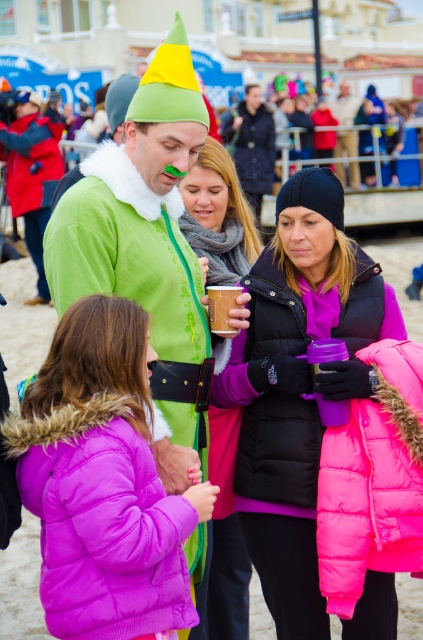
Does green felt hat at upper center have a smaller size compared to brown paper cup at center?

No.

I want to click on green felt hat at upper center, so click(x=252, y=145).

Describe the element at coordinates (252, 145) in the screenshot. The width and height of the screenshot is (423, 640). I see `green felt hat at upper center` at that location.

Identify the location of green felt hat at upper center. This screenshot has width=423, height=640. (252, 145).

At what (x,y) coordinates should I click in order to perform the action: click on purple puffy coat at center. Please return your answer as a coordinate pair (x, y). Image resolution: width=423 pixels, height=640 pixels. Looking at the image, I should click on (102, 483).

Describe the element at coordinates (102, 483) in the screenshot. The height and width of the screenshot is (640, 423). I see `purple puffy coat at center` at that location.

This screenshot has width=423, height=640. In order to click on purple puffy coat at center in this screenshot , I will do `click(102, 483)`.

Is purple puffy coat at center taller than green felt hat at upper center?

No, purple puffy coat at center is not taller than green felt hat at upper center.

Does purple puffy coat at center have a lesser width compared to green felt hat at upper center?

Yes.

Between point (102, 396) and point (238, 152), which one is positioned in front?

Positioned in front is point (102, 396).

Locate an element on the screen. The image size is (423, 640). purple puffy coat at center is located at coordinates (102, 483).